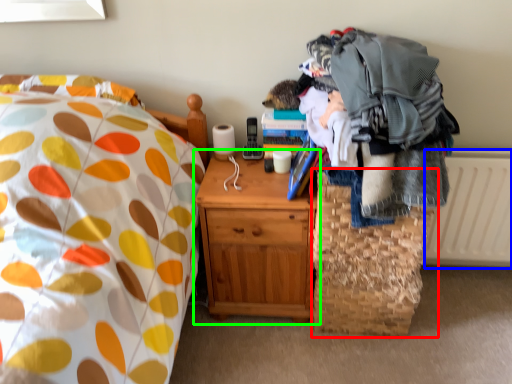
Question: Which is nearer to the basket (highlighted by a red box)? radiator (highlighted by a blue box) or nightstand (highlighted by a green box).

Choices:
 (A) radiator
 (B) nightstand

Answer: (B)